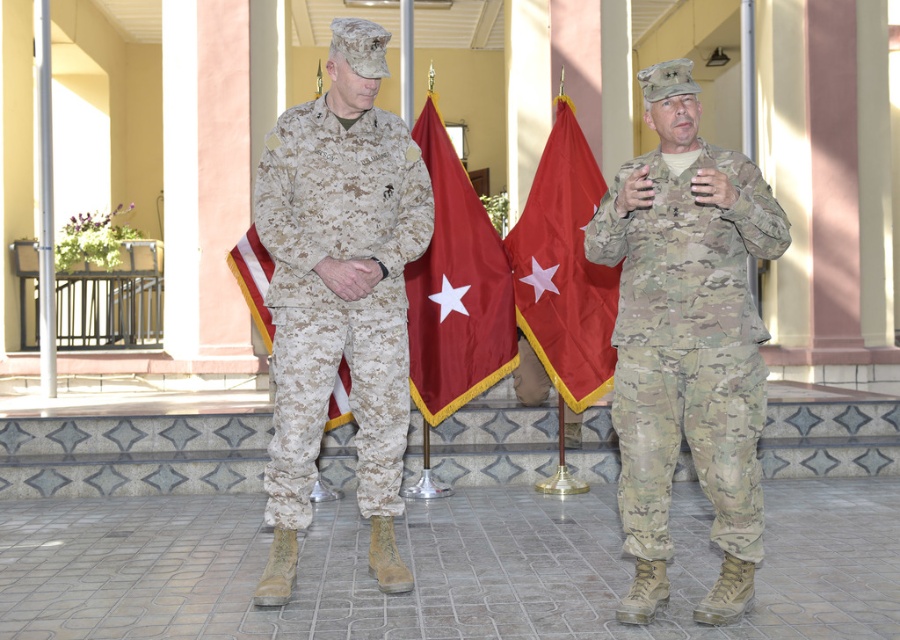
Question: Does camouflage fabric uniform at right have a greater width compared to camouflage fabric flag at center?

Choices:
 (A) no
 (B) yes

Answer: (B)

Question: Which object appears farthest from the camera in this image?

Choices:
 (A) camouflage fabric uniform at center
 (B) red fabric flag at center

Answer: (B)

Question: Which point is farther to the camera?

Choices:
 (A) (662, 516)
 (B) (333, 358)
 (C) (451, 145)

Answer: (C)

Question: Is camouflage fabric uniform at right closer to the viewer compared to camouflage fabric flag at center?

Choices:
 (A) no
 (B) yes

Answer: (B)

Question: Observing the image, what is the correct spatial positioning of camouflage fabric uniform at right in reference to red fabric flag at center?

Choices:
 (A) right
 (B) left

Answer: (A)

Question: Which point appears farthest from the camera in this image?

Choices:
 (A) (310, 156)
 (B) (747, 324)
 (C) (527, 276)
 (D) (255, 323)

Answer: (D)